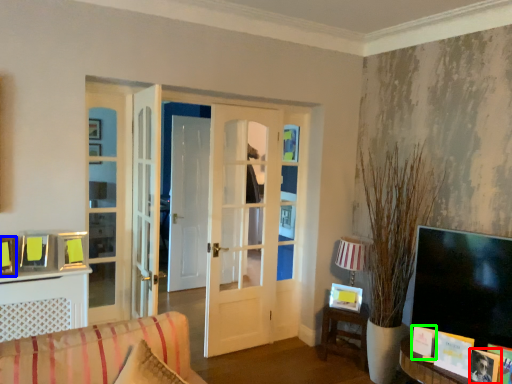
Question: Which is nearer to the picture frame (highlighted by a red box)? picture frame (highlighted by a blue box) or picture frame (highlighted by a green box).

Choices:
 (A) picture frame
 (B) picture frame

Answer: (B)